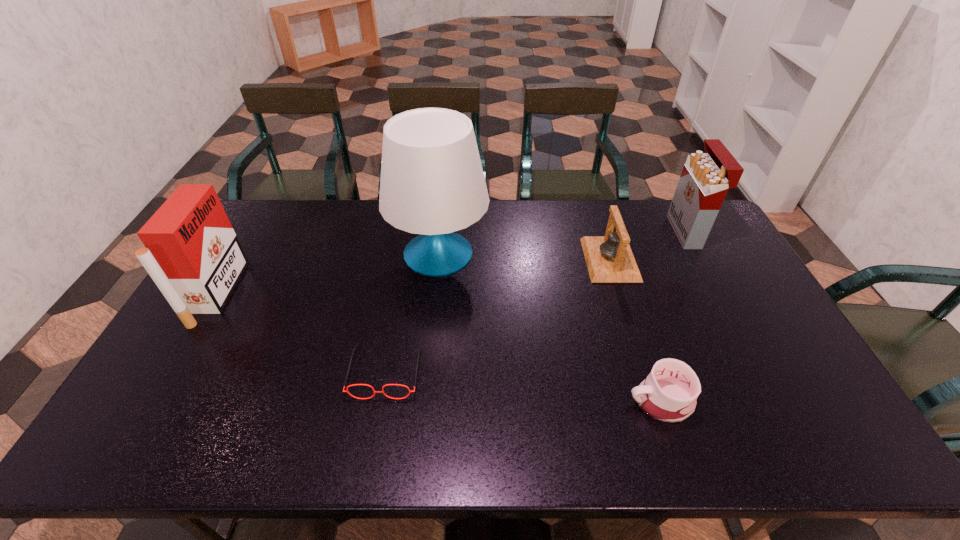
The width and height of the screenshot is (960, 540). Find the location of `bell that is positioned at the far edge`. bell that is positioned at the far edge is located at coordinates (609, 258).

Where is `object that is at the near edge`? object that is at the near edge is located at coordinates point(669,393).

The height and width of the screenshot is (540, 960). I want to click on object that is at the left edge, so click(x=193, y=255).

Locate an element on the screen. The width and height of the screenshot is (960, 540). object that is at the right edge is located at coordinates (706, 177).

Where is `object situated at the far right corner`? The height and width of the screenshot is (540, 960). object situated at the far right corner is located at coordinates (706, 177).

Identify the location of free region at the far edge of the desktop. (554, 210).

Identify the location of vacant region at the near edge of the desktop. This screenshot has height=540, width=960. (299, 444).

I want to click on free space at the left edge of the desktop, so click(x=238, y=310).

Locate an element on the screen. This screenshot has height=540, width=960. vacant space at the far left corner of the desktop is located at coordinates point(254,224).

The width and height of the screenshot is (960, 540). In order to click on free space at the near left corner of the desktop in this screenshot , I will do `click(173, 443)`.